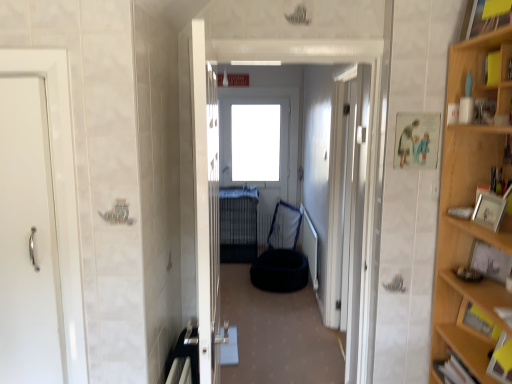
Question: Can you confirm if dark blue fabric pet bed at center is bigger than wooden picture frame at right, which is counted as the 2th picture frame, starting from the left?

Choices:
 (A) yes
 (B) no

Answer: (A)

Question: Is dark blue fabric pet bed at center closer to the viewer compared to wooden picture frame at right, placed as the first picture frame when sorted from right to left?

Choices:
 (A) no
 (B) yes

Answer: (A)

Question: From a real-world perspective, is dark blue fabric pet bed at center positioned under wooden picture frame at right, placed as the first picture frame when sorted from right to left, based on gravity?

Choices:
 (A) yes
 (B) no

Answer: (B)

Question: Considering the relative sizes of dark blue fabric pet bed at center and wooden picture frame at right, placed as the first picture frame when sorted from right to left, in the image provided, is dark blue fabric pet bed at center shorter than wooden picture frame at right, placed as the first picture frame when sorted from right to left,?

Choices:
 (A) no
 (B) yes

Answer: (A)

Question: Does dark blue fabric pet bed at center appear on the right side of wooden picture frame at right, placed as the first picture frame when sorted from right to left?

Choices:
 (A) yes
 (B) no

Answer: (B)

Question: Is dark blue fabric pet bed at center thinner than wooden picture frame at right, placed as the first picture frame when sorted from right to left?

Choices:
 (A) no
 (B) yes

Answer: (A)

Question: From the image's perspective, would you say metallic silver bunk bed at center is shown under white glossy door at center, which ranks as the first door in front-to-back order?

Choices:
 (A) yes
 (B) no

Answer: (A)

Question: From a real-world perspective, is metallic silver bunk bed at center on top of white glossy door at center, which ranks as the second door in right-to-left order?

Choices:
 (A) yes
 (B) no

Answer: (B)

Question: Is metallic silver bunk bed at center located outside white glossy door at center, which ranks as the second door in right-to-left order?

Choices:
 (A) no
 (B) yes

Answer: (B)

Question: Is white glossy door at center, which ranks as the first door in front-to-back order, surrounded by metallic silver bunk bed at center?

Choices:
 (A) no
 (B) yes

Answer: (A)

Question: Can you confirm if metallic silver bunk bed at center is smaller than white glossy door at center, which is counted as the third door, starting from the back?

Choices:
 (A) yes
 (B) no

Answer: (B)

Question: Is metallic silver bunk bed at center in front of white glossy door at center, which ranks as the second door in right-to-left order?

Choices:
 (A) no
 (B) yes

Answer: (A)

Question: Is dark blue fabric pet bed at center further to camera compared to dark blue fabric bean bag at center?

Choices:
 (A) no
 (B) yes

Answer: (A)